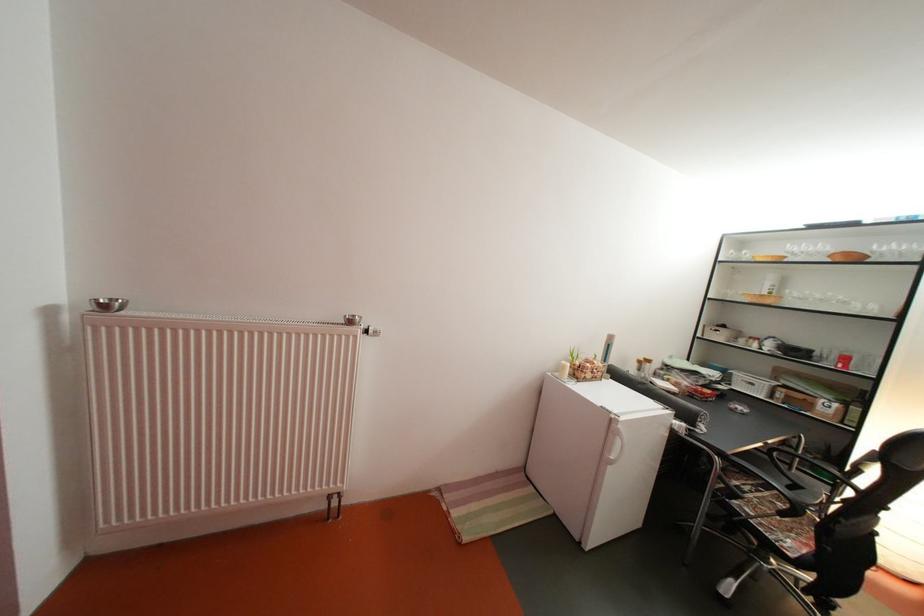
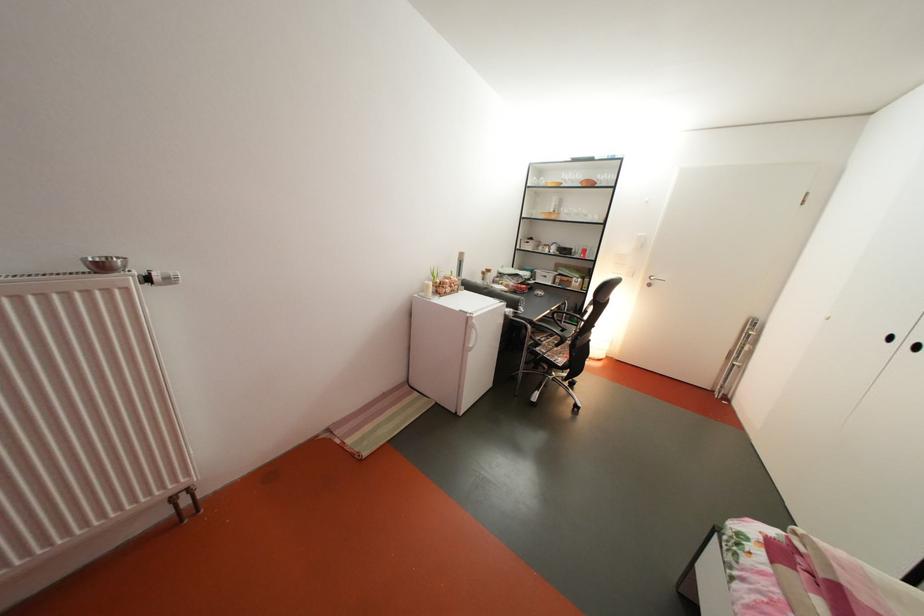
Find the pixel in the second image that matches (x=382, y=338) in the first image.

(168, 285)